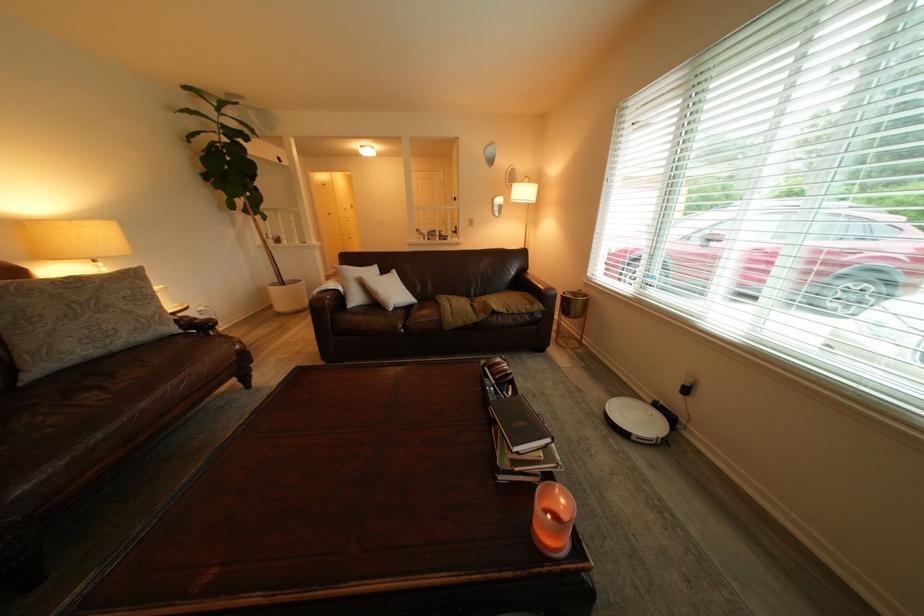
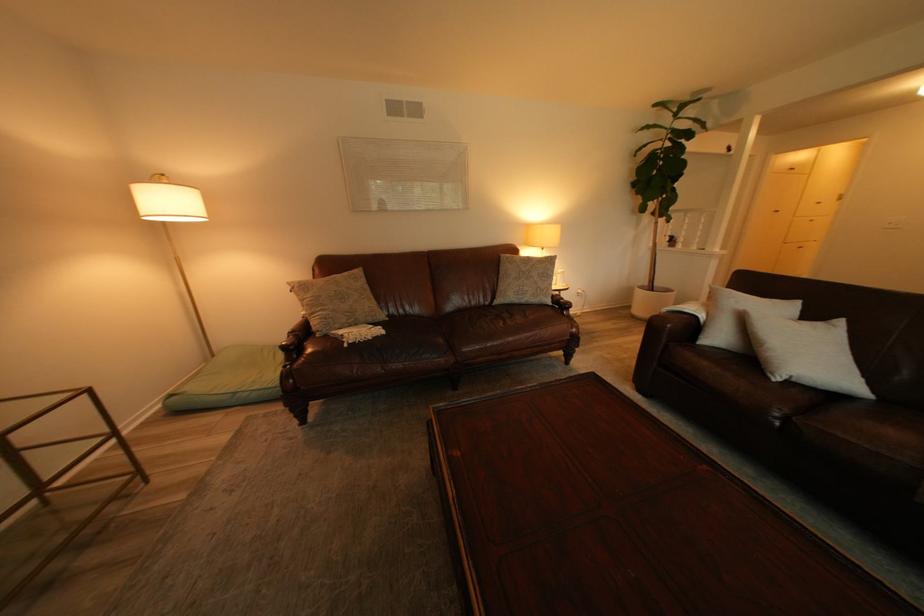
Find the pixel in the second image that matches (x=196, y=331) in the first image.

(565, 305)